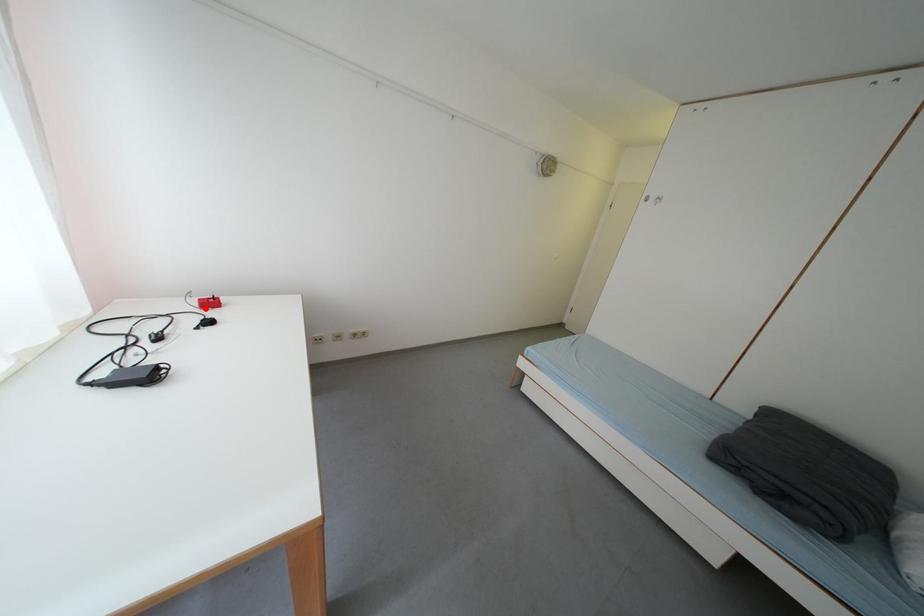
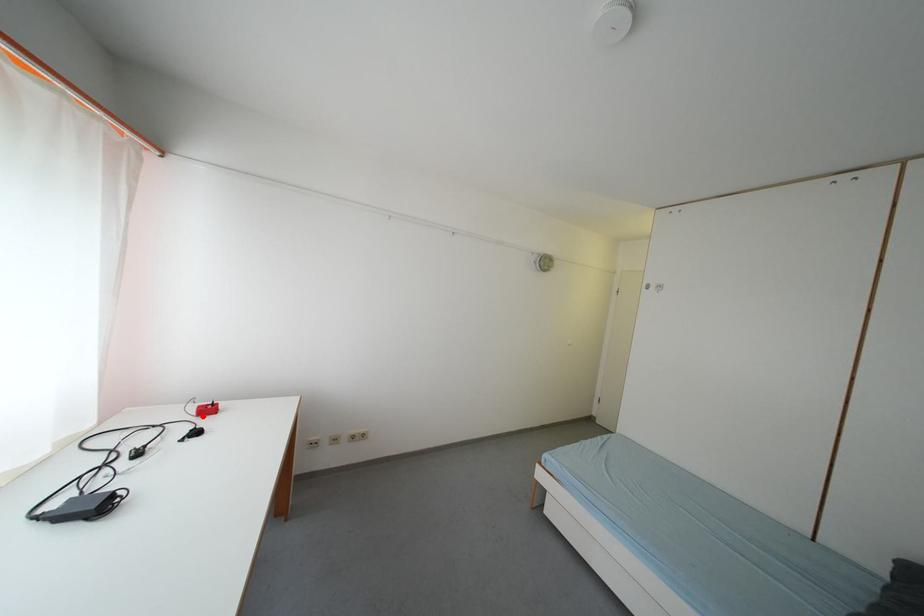
I am providing you with two images of the same scene from different viewpoints. A red point is marked on the first image and another point is marked on the second image. Is the red point in image1 aligned with the point shown in image2?

Yes